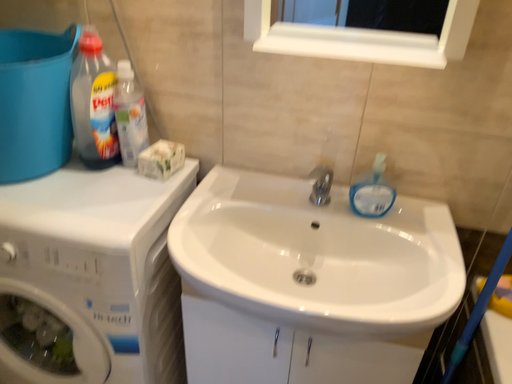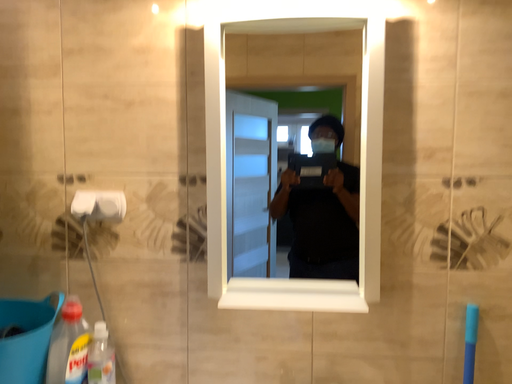
Question: How did the camera likely rotate when shooting the video?

Choices:
 (A) rotated upward
 (B) rotated downward

Answer: (A)